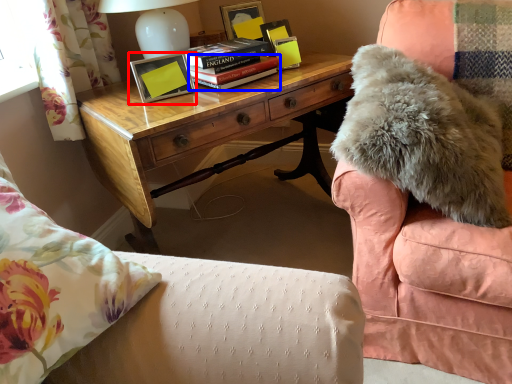
Question: Which of the following is the closest to the observer, picture frame (highlighted by a red box) or paperback book (highlighted by a blue box)?

Choices:
 (A) picture frame
 (B) paperback book

Answer: (A)